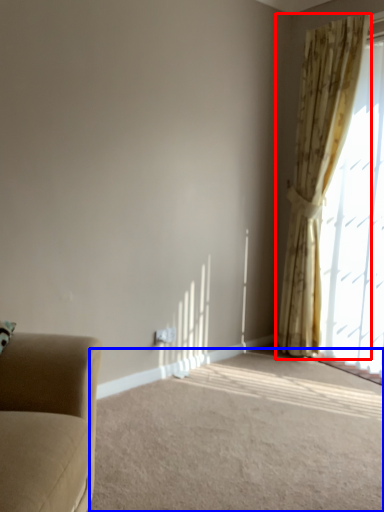
Question: Which object appears closest to the camera in this image, curtain (highlighted by a red box) or plain (highlighted by a blue box)?

Choices:
 (A) curtain
 (B) plain

Answer: (B)